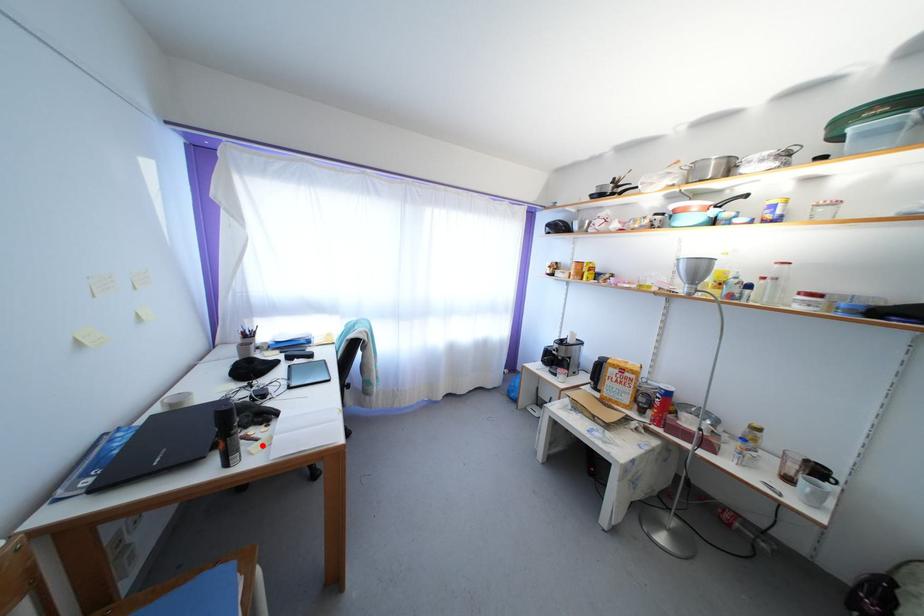
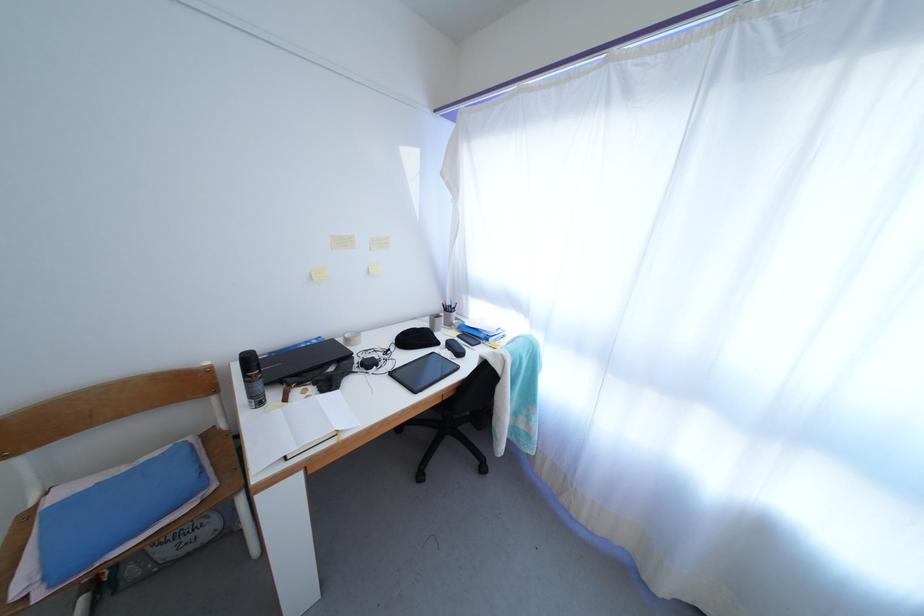
In the second image, find the point that corresponds to the highlighted location in the first image.

(290, 406)